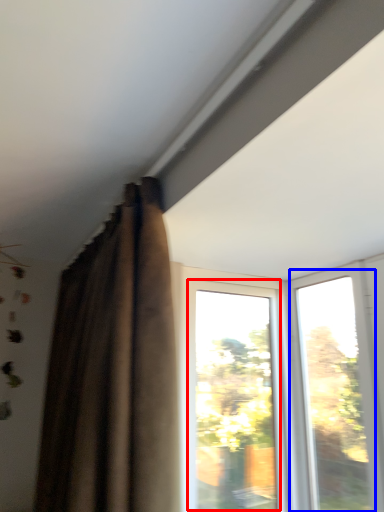
Question: Which of the following is the closest to the observer, window (highlighted by a red box) or window (highlighted by a blue box)?

Choices:
 (A) window
 (B) window

Answer: (B)